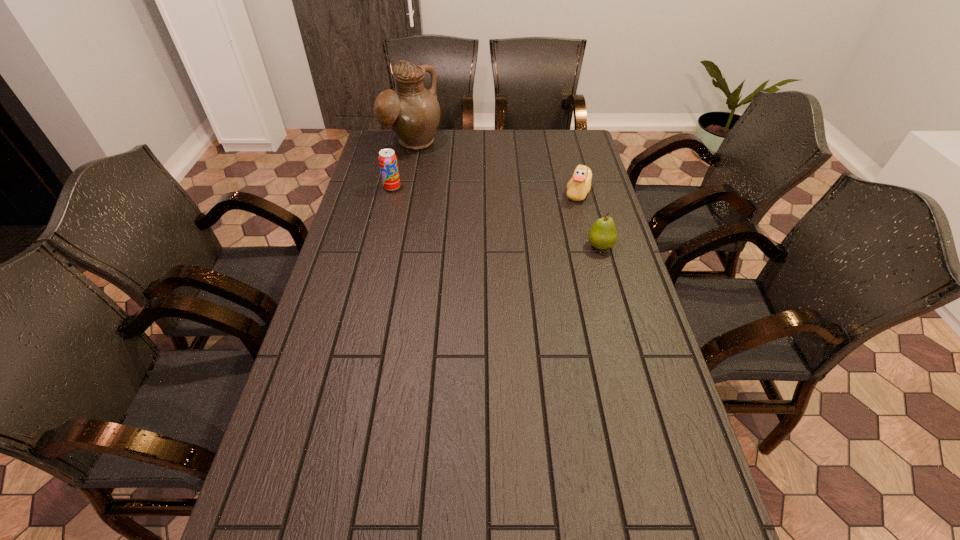
Where is `free space on the desktop that is between the soda can and the pear and is positioned at the beak of the duck`? free space on the desktop that is between the soda can and the pear and is positioned at the beak of the duck is located at coordinates (492, 215).

Find the location of a particular element. The width and height of the screenshot is (960, 540). free spot on the desktop that is between the soda can and the nearest object and is positioned at the spout of the farthest object is located at coordinates (498, 217).